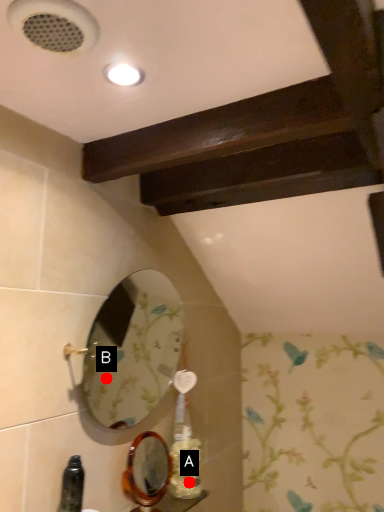
Question: Two points are circled on the image, labeled by A and B beside each circle. Among these points, which one is farthest from the camera?

Choices:
 (A) A is further
 (B) B is further

Answer: (B)